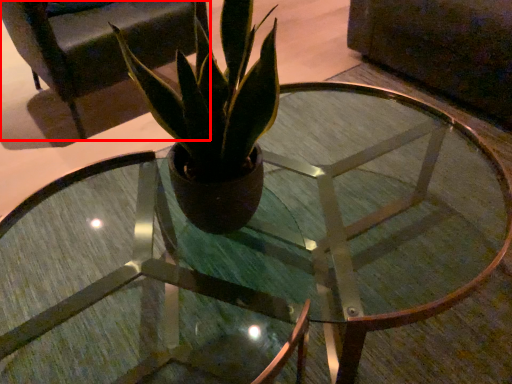
Question: In this image, where is armchair (annotated by the red box) located relative to houseplant?

Choices:
 (A) right
 (B) left

Answer: (B)